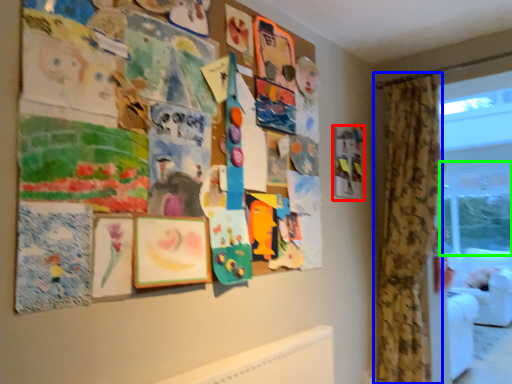
Question: Based on their relative distances, which object is farther from picture frame (highlighted by a red box)? Choose from curtain (highlighted by a blue box) and window screen (highlighted by a green box).

Choices:
 (A) curtain
 (B) window screen

Answer: (B)